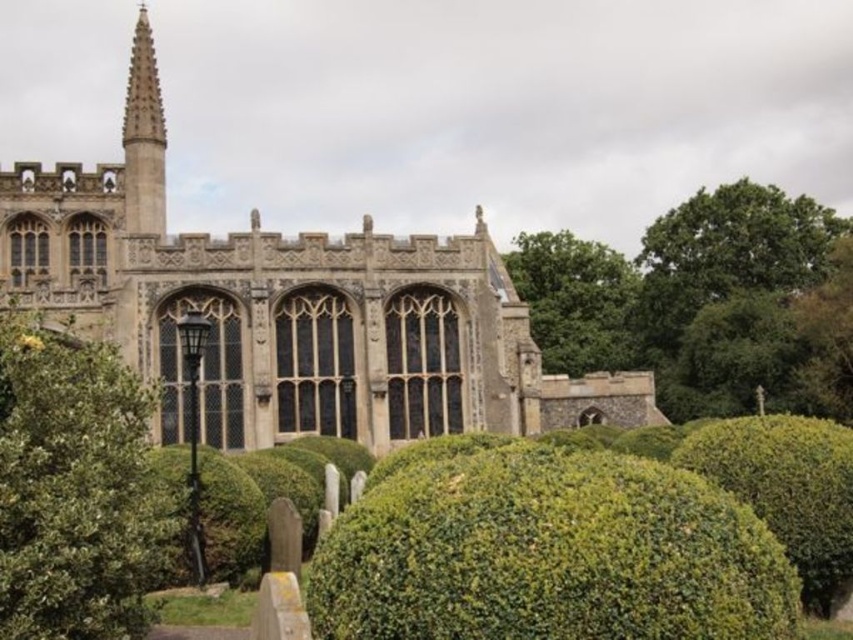
Question: Is green leafy tree at upper right positioned at the back of green leafy bush at lower left?

Choices:
 (A) yes
 (B) no

Answer: (A)

Question: Based on their relative distances, which object is nearer to the green leafy hedge at lower center?

Choices:
 (A) smooth stone spire at upper left
 (B) green leafy tree at right

Answer: (B)

Question: Does green leafy bush at lower left appear on the left side of smooth stone spire at upper left?

Choices:
 (A) no
 (B) yes

Answer: (A)

Question: Which is farther from the green leafy tree at right?

Choices:
 (A) green leafy tree at upper right
 (B) smooth stone spire at upper left

Answer: (B)

Question: Which of the following is the farthest from the observer?

Choices:
 (A) (294, 296)
 (B) (570, 292)

Answer: (B)

Question: Can you confirm if green leafy tree at right is positioned above smooth stone spire at upper left?

Choices:
 (A) yes
 (B) no

Answer: (B)